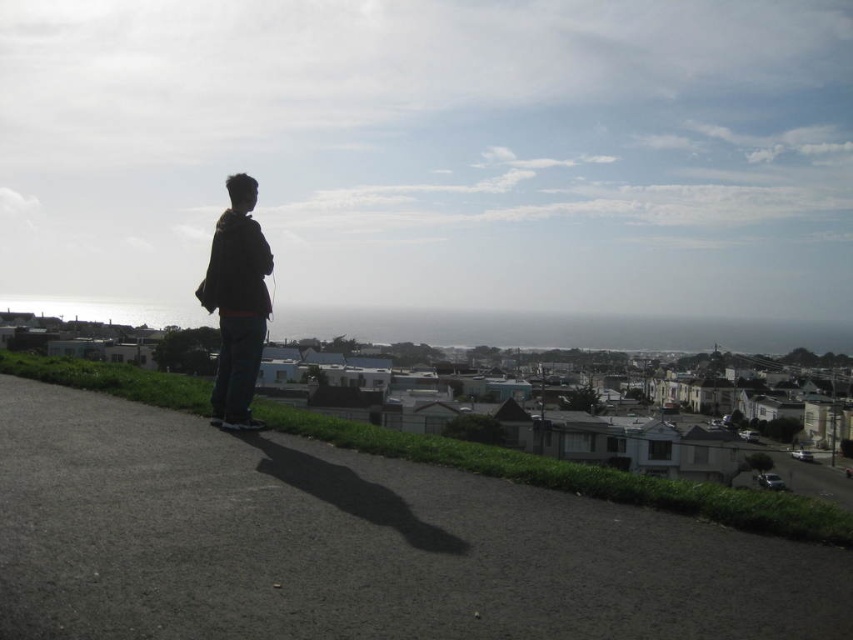
You are a photographer trying to capture the scene with the dark asphalt pavement at lower left and the dark brown jacket at center. To ensure both are in frame, should you adjust your camera to the left or right?

The dark asphalt pavement at lower left is to the right of the dark brown jacket at center. Therefore, you should adjust your camera to the left to include both objects in the frame.

You are a photographer planning to capture a shot of the dark asphalt pavement at lower left and the dark brown jacket at center. Which object appears closer to the camera in the image?

The dark asphalt pavement at lower left appears closer to the camera because it has a lesser height compared to the dark brown jacket at center.

You are a photographer trying to capture the scene from the person in the dark brown jacket at center. To get a clear shot of the dark asphalt pavement at lower left, should you move forward or backward?

The dark asphalt pavement at lower left is in front of the dark brown jacket at center, so to capture it clearly, you should move forward towards the pavement.